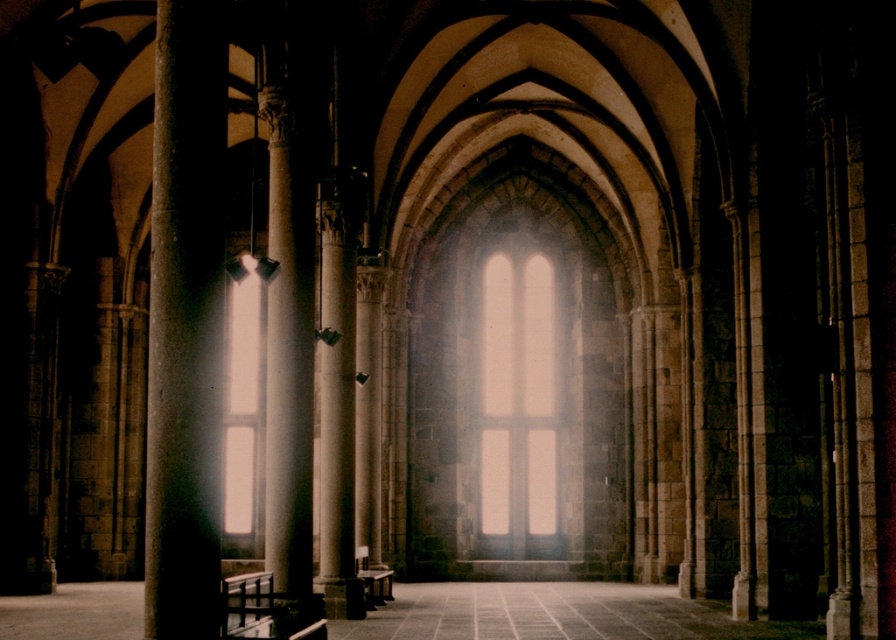
Question: Considering the real-world distances, which object is farthest from the white marble column at center?

Choices:
 (A) smooth stone pillar at left
 (B) translucent glass window at center

Answer: (B)

Question: Does smooth stone pillar at left appear over white marble column at center?

Choices:
 (A) yes
 (B) no

Answer: (A)

Question: Is smooth stone pillar at left to the left of translucent glass window at center from the viewer's perspective?

Choices:
 (A) yes
 (B) no

Answer: (A)

Question: Where is white marble column at center located in relation to translucent glass window at center in the image?

Choices:
 (A) below
 (B) above

Answer: (B)

Question: Which object is closer to the camera taking this photo?

Choices:
 (A) white marble column at center
 (B) smooth stone pillar at left

Answer: (B)

Question: Which object is farther from the camera taking this photo?

Choices:
 (A) smooth stone pillar at left
 (B) white marble column at center
 (C) translucent glass window at center

Answer: (C)